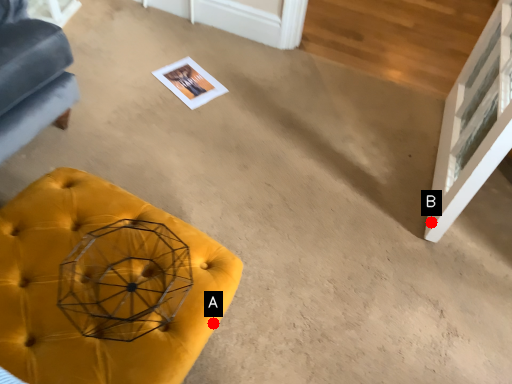
Question: Two points are circled on the image, labeled by A and B beside each circle. Which of the following is the farthest from the observer?

Choices:
 (A) A is further
 (B) B is further

Answer: (B)